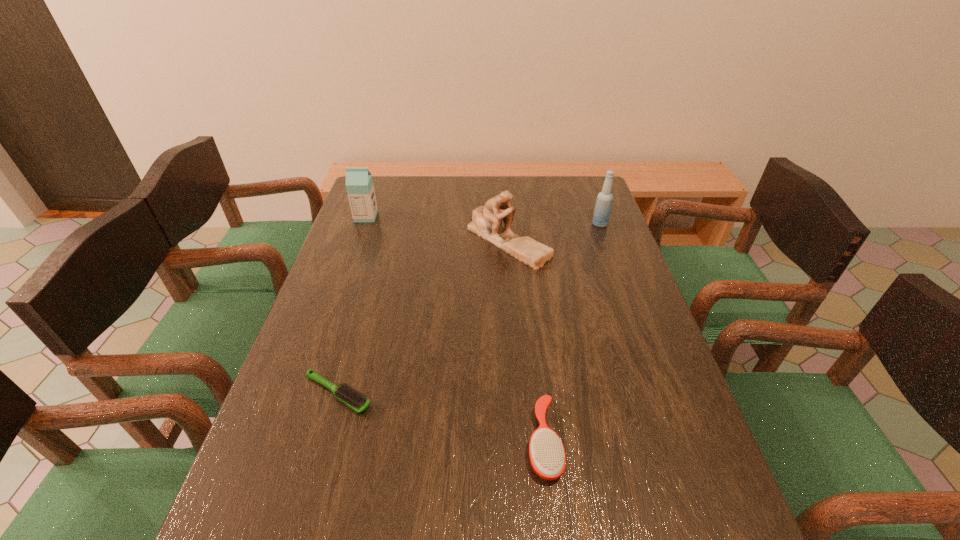
Locate an element on the screen. The width and height of the screenshot is (960, 540). free region located on the left of the right hairbrush is located at coordinates (444, 441).

The width and height of the screenshot is (960, 540). What are the coordinates of `free spot located on the back of the left hairbrush` in the screenshot? It's located at (366, 294).

You are a GUI agent. You are given a task and a screenshot of the screen. Output one action in this format:
    pyautogui.click(x=<x>, y=<y>)
    Task: Click on the milk carton present at the left edge
    The image size is (960, 540).
    Given the screenshot: What is the action you would take?
    pyautogui.click(x=359, y=184)

Where is `hairbrush present at the left edge`? hairbrush present at the left edge is located at coordinates (346, 394).

Find the location of a particular element. This screenshot has height=540, width=960. object at the right edge is located at coordinates (603, 205).

Where is `vacant region at the far edge`? vacant region at the far edge is located at coordinates (482, 192).

This screenshot has height=540, width=960. I want to click on vacant space at the left edge, so click(x=323, y=393).

At what (x,y) coordinates should I click in order to perform the action: click on free space at the right edge of the desktop. Please return your answer as a coordinate pair (x, y). The height and width of the screenshot is (540, 960). Looking at the image, I should click on (667, 361).

Locate an element on the screen. This screenshot has height=540, width=960. vacant space at the far left corner of the desktop is located at coordinates (384, 193).

Image resolution: width=960 pixels, height=540 pixels. I want to click on free space at the far right corner, so click(x=574, y=195).